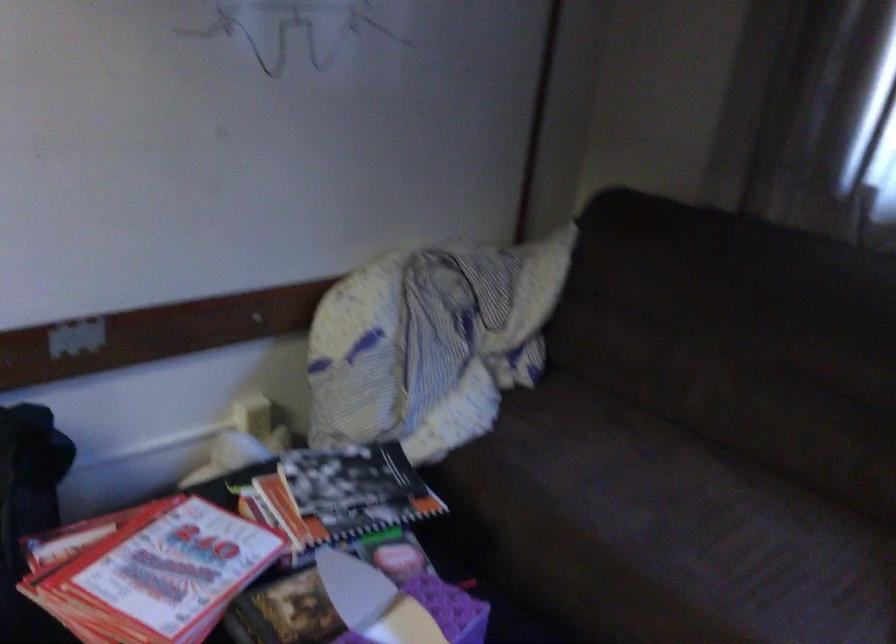
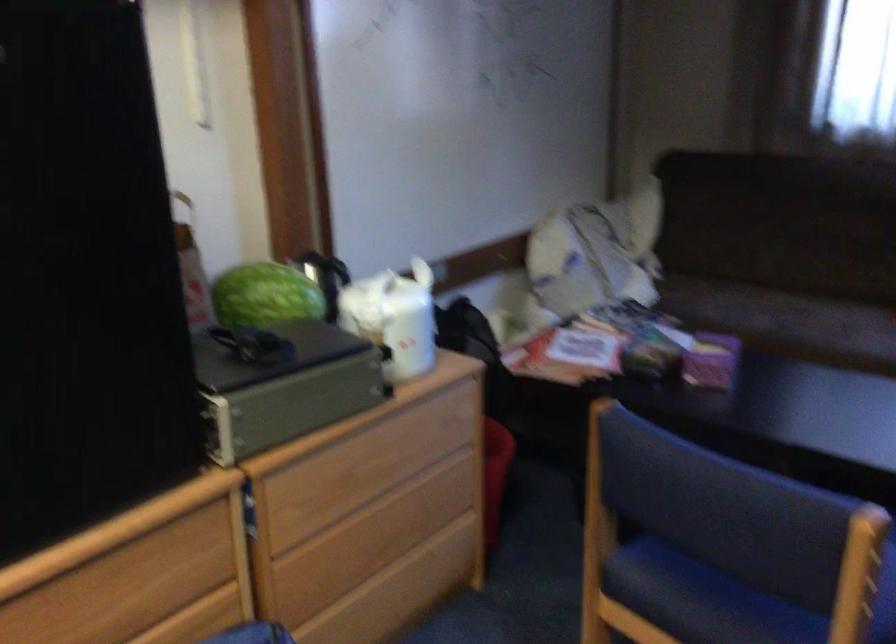
In the second image, find the point that corresponds to pixel 659 556 in the first image.

(787, 322)